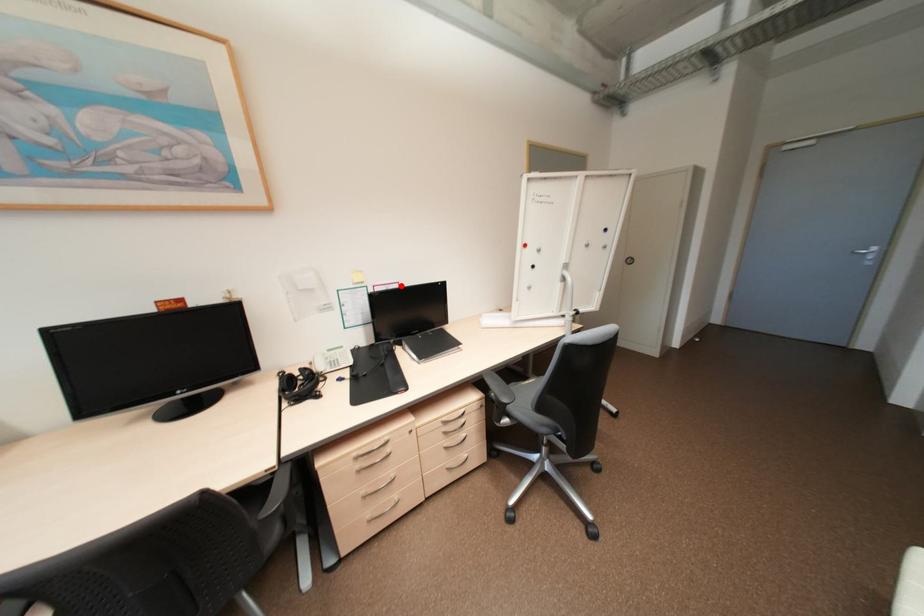
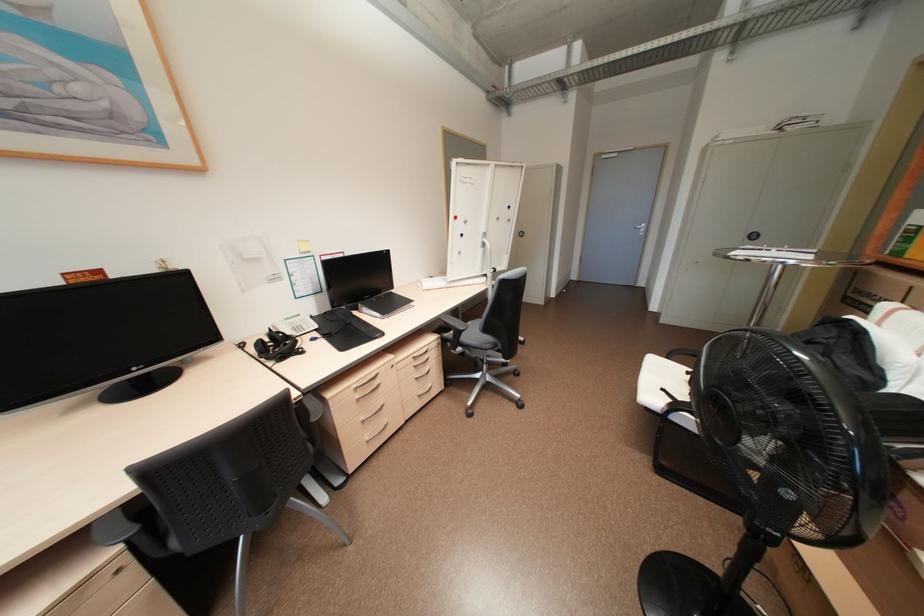
The point at the highlighted location is marked in the first image. Where is the corresponding point in the second image?

(346, 256)